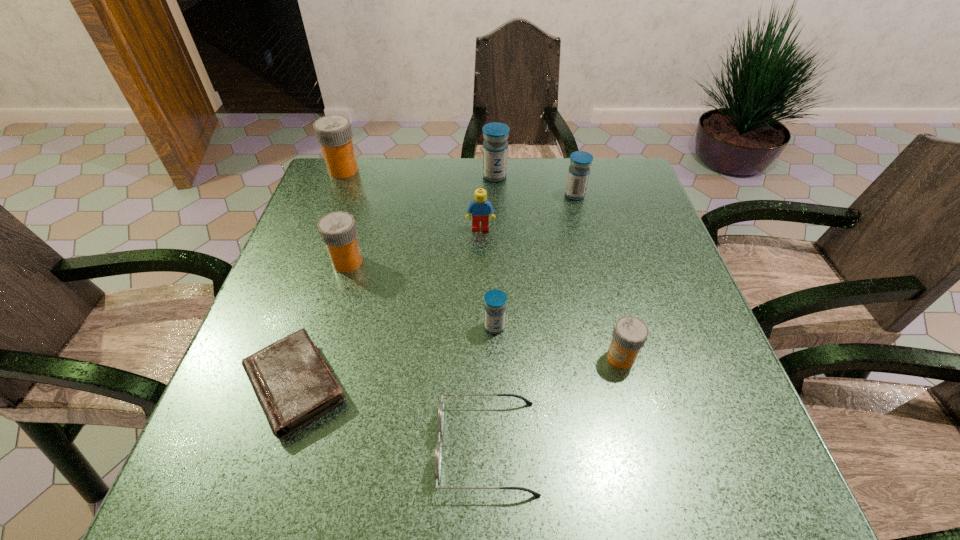
Where is `free space located on the label side of the nearest orange medicine`? This screenshot has width=960, height=540. free space located on the label side of the nearest orange medicine is located at coordinates (508, 357).

Where is `free space located 0.250m on the label side of the nearest orange medicine`? free space located 0.250m on the label side of the nearest orange medicine is located at coordinates (477, 357).

Locate an element on the screen. The image size is (960, 540). free location located 0.100m on the label side of the nearest orange medicine is located at coordinates (555, 357).

Image resolution: width=960 pixels, height=540 pixels. I want to click on free space located on the left of the fifth farthest medicine, so click(x=348, y=327).

You are a GUI agent. You are given a task and a screenshot of the screen. Output one action in this format:
    pyautogui.click(x=<x>, y=<y>)
    Task: Click on the free space located 0.070m on the front-facing side of the eighth tallest object
    The width and height of the screenshot is (960, 540).
    Given the screenshot: What is the action you would take?
    pyautogui.click(x=396, y=447)

Locate an element on the screen. vacant region located 0.250m on the front-facing side of the eighth tallest object is located at coordinates (288, 447).

Locate an element on the screen. The width and height of the screenshot is (960, 540). vacant region located on the front-facing side of the eighth tallest object is located at coordinates (367, 447).

Identify the location of vacant space located 0.070m on the back of the diary. The height and width of the screenshot is (540, 960). (320, 311).

Find the location of a particular element. This screenshot has width=960, height=540. object that is at the near edge is located at coordinates (438, 452).

Locate an element on the screen. diary that is at the left edge is located at coordinates (293, 384).